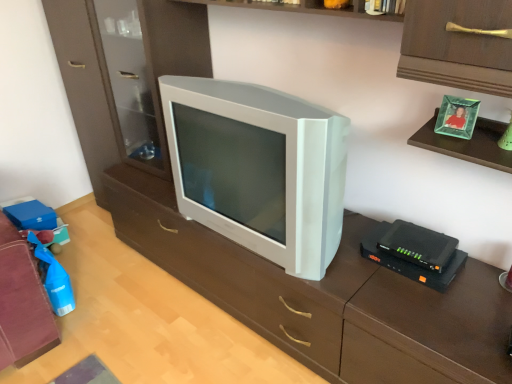
Question: Does white plastic television at center have a larger size compared to black plastic router at right?

Choices:
 (A) yes
 (B) no

Answer: (A)

Question: Does white plastic television at center have a lesser height compared to black plastic router at right?

Choices:
 (A) yes
 (B) no

Answer: (B)

Question: Does white plastic television at center come in front of black plastic router at right?

Choices:
 (A) no
 (B) yes

Answer: (B)

Question: Would you say white plastic television at center is outside black plastic router at right?

Choices:
 (A) no
 (B) yes

Answer: (B)

Question: Does white plastic television at center have a greater width compared to black plastic router at right?

Choices:
 (A) no
 (B) yes

Answer: (B)

Question: From the image's perspective, would you say white plastic television at center is shown under black plastic router at right?

Choices:
 (A) yes
 (B) no

Answer: (B)

Question: Is white plastic tv at center in front of black plastic router at right?

Choices:
 (A) yes
 (B) no

Answer: (A)

Question: From a real-world perspective, is white plastic tv at center positioned under black plastic router at right based on gravity?

Choices:
 (A) yes
 (B) no

Answer: (A)

Question: Can you confirm if white plastic tv at center is shorter than black plastic router at right?

Choices:
 (A) no
 (B) yes

Answer: (A)

Question: Considering the relative sizes of white plastic tv at center and black plastic router at right in the image provided, is white plastic tv at center bigger than black plastic router at right?

Choices:
 (A) no
 (B) yes

Answer: (B)

Question: Is white plastic tv at center looking in the opposite direction of black plastic router at right?

Choices:
 (A) no
 (B) yes

Answer: (A)

Question: Is white plastic tv at center positioned behind black plastic router at right?

Choices:
 (A) yes
 (B) no

Answer: (B)

Question: Is black plastic router at right not within white plastic television at center?

Choices:
 (A) yes
 (B) no

Answer: (A)